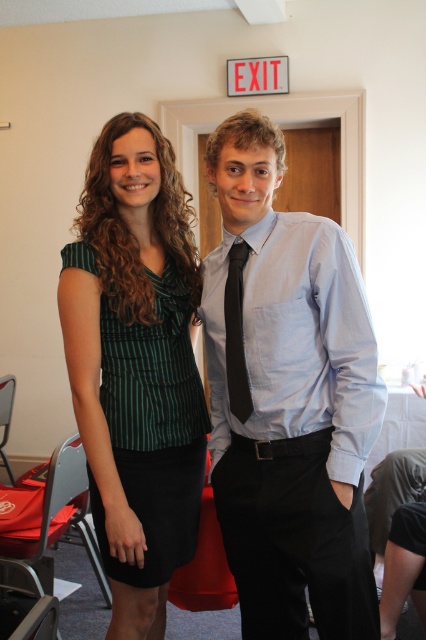
Question: Which point is closer to the camera?

Choices:
 (A) (173, 410)
 (B) (235, 362)

Answer: (B)

Question: Does light blue shirt at center appear under green striped blouse at center?

Choices:
 (A) yes
 (B) no

Answer: (B)

Question: Can you confirm if green striped blouse at center is positioned to the right of black silk tie at center?

Choices:
 (A) yes
 (B) no

Answer: (B)

Question: Can you confirm if light blue shirt at center is positioned below green striped blouse at center?

Choices:
 (A) yes
 (B) no

Answer: (B)

Question: Which point is farther from the camera taking this photo?

Choices:
 (A) (342, 272)
 (B) (97, 410)
 (C) (233, 288)

Answer: (C)

Question: Which of the following is the closest to the observer?

Choices:
 (A) (238, 579)
 (B) (123, 602)

Answer: (B)